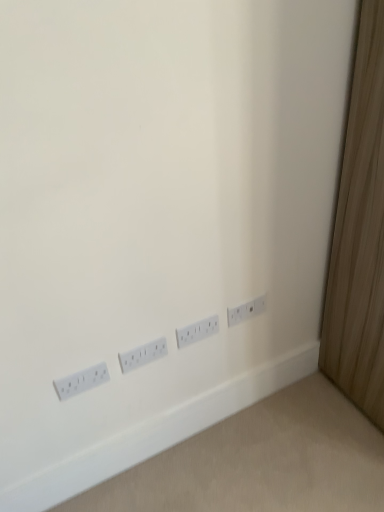
What do you see at coordinates (246, 310) in the screenshot? The width and height of the screenshot is (384, 512). I see `white plastic power plugs and sockets at lower right, the fourth power plugs and sockets viewed from the left` at bounding box center [246, 310].

In order to face white plastic power plugs and sockets at lower left, the fourth power plugs and sockets viewed from the right, should I rotate leftwards or rightwards?

A 14.332 degree turn to the left will do.

The width and height of the screenshot is (384, 512). Identify the location of white plastic power plugs and sockets at lower right, the 3th power plugs and sockets from the left. (197, 331).

You are a GUI agent. You are given a task and a screenshot of the screen. Output one action in this format:
    pyautogui.click(x=<x>, y=<y>)
    Task: Click on the white plastic power plugs and sockets at lower right, the first power plugs and sockets when ordered from right to left
    This screenshot has height=512, width=384.
    Given the screenshot: What is the action you would take?
    pyautogui.click(x=246, y=310)

From a real-world perspective, which is physically below, white plastic power plugs and sockets at center, marked as the third power plugs and sockets in a right-to-left arrangement, or white plastic power plugs and sockets at lower right, the 3th power plugs and sockets from the left?

From a 3D spatial view, white plastic power plugs and sockets at center, marked as the third power plugs and sockets in a right-to-left arrangement, is below.

Would you say white plastic power plugs and sockets at lower right, which is counted as the 2th power plugs and sockets, starting from the right, is part of white plastic power plugs and sockets at center, marked as the third power plugs and sockets in a right-to-left arrangement,'s contents?

Actually, white plastic power plugs and sockets at lower right, which is counted as the 2th power plugs and sockets, starting from the right, is outside white plastic power plugs and sockets at center, marked as the third power plugs and sockets in a right-to-left arrangement.

From the image's perspective, does white plastic power plugs and sockets at center, marked as the third power plugs and sockets in a right-to-left arrangement, appear lower than white plastic power plugs and sockets at lower right, the 3th power plugs and sockets from the left?

Result: Yes, from the image's perspective, white plastic power plugs and sockets at center, marked as the third power plugs and sockets in a right-to-left arrangement, is beneath white plastic power plugs and sockets at lower right, the 3th power plugs and sockets from the left.

Considering the sizes of white plastic power plugs and sockets at center, positioned as the second power plugs and sockets in left-to-right order, and white plastic power plugs and sockets at lower right, the 3th power plugs and sockets from the left, in the image, is white plastic power plugs and sockets at center, positioned as the second power plugs and sockets in left-to-right order, wider or thinner than white plastic power plugs and sockets at lower right, the 3th power plugs and sockets from the left,?

In the image, white plastic power plugs and sockets at center, positioned as the second power plugs and sockets in left-to-right order, appears to be more narrow than white plastic power plugs and sockets at lower right, the 3th power plugs and sockets from the left.

From a real-world perspective, which object rests below the other?

white plastic power plugs and sockets at lower left, the fourth power plugs and sockets viewed from the right, is physically lower.

Is white plastic power plugs and sockets at lower right, the first power plugs and sockets when ordered from right to left, closer to the viewer compared to white plastic power plugs and sockets at lower left, the 1th power plugs and sockets in the left-to-right sequence?

That is False.

Is white plastic power plugs and sockets at lower right, the first power plugs and sockets when ordered from right to left, to the right of white plastic power plugs and sockets at lower left, the 1th power plugs and sockets in the left-to-right sequence, from the viewer's perspective?

Indeed, white plastic power plugs and sockets at lower right, the first power plugs and sockets when ordered from right to left, is positioned on the right side of white plastic power plugs and sockets at lower left, the 1th power plugs and sockets in the left-to-right sequence.

Find the location of a particular element. the 3rd power plugs and sockets to the left of the white plastic power plugs and sockets at lower right, the fourth power plugs and sockets viewed from the left, starting your count from the anchor is located at coordinates (81, 381).

In the scene shown: Who is shorter, white plastic power plugs and sockets at lower left, the 1th power plugs and sockets in the left-to-right sequence, or white plastic power plugs and sockets at lower right, the first power plugs and sockets when ordered from right to left?

Standing shorter between the two is white plastic power plugs and sockets at lower right, the first power plugs and sockets when ordered from right to left.

Is white plastic power plugs and sockets at lower left, the fourth power plugs and sockets viewed from the right, inside or outside of white plastic power plugs and sockets at lower right, the first power plugs and sockets when ordered from right to left?

white plastic power plugs and sockets at lower left, the fourth power plugs and sockets viewed from the right, is not inside white plastic power plugs and sockets at lower right, the first power plugs and sockets when ordered from right to left, it's outside.

Is white plastic power plugs and sockets at lower left, the 1th power plugs and sockets in the left-to-right sequence, far from white plastic power plugs and sockets at lower right, the fourth power plugs and sockets viewed from the left?

Actually, white plastic power plugs and sockets at lower left, the 1th power plugs and sockets in the left-to-right sequence, and white plastic power plugs and sockets at lower right, the fourth power plugs and sockets viewed from the left, are a little close together.

From the image's perspective, is white plastic power plugs and sockets at lower left, the 1th power plugs and sockets in the left-to-right sequence, beneath white plastic power plugs and sockets at center, marked as the third power plugs and sockets in a right-to-left arrangement?

Yes, from the image's perspective, white plastic power plugs and sockets at lower left, the 1th power plugs and sockets in the left-to-right sequence, is below white plastic power plugs and sockets at center, marked as the third power plugs and sockets in a right-to-left arrangement.

Based on their positions, is white plastic power plugs and sockets at lower left, the fourth power plugs and sockets viewed from the right, located to the left or right of white plastic power plugs and sockets at center, positioned as the second power plugs and sockets in left-to-right order?

white plastic power plugs and sockets at lower left, the fourth power plugs and sockets viewed from the right, is positioned on white plastic power plugs and sockets at center, positioned as the second power plugs and sockets in left-to-right order,'s left side.

Which is behind, white plastic power plugs and sockets at lower left, the fourth power plugs and sockets viewed from the right, or white plastic power plugs and sockets at center, positioned as the second power plugs and sockets in left-to-right order?

white plastic power plugs and sockets at center, positioned as the second power plugs and sockets in left-to-right order, is behind.

Considering the sizes of objects white plastic power plugs and sockets at lower left, the fourth power plugs and sockets viewed from the right, and white plastic power plugs and sockets at center, positioned as the second power plugs and sockets in left-to-right order, in the image provided, who is bigger, white plastic power plugs and sockets at lower left, the fourth power plugs and sockets viewed from the right, or white plastic power plugs and sockets at center, positioned as the second power plugs and sockets in left-to-right order,?

With larger size is white plastic power plugs and sockets at center, positioned as the second power plugs and sockets in left-to-right order.

How different are the orientations of white plastic power plugs and sockets at lower right, which is counted as the 2th power plugs and sockets, starting from the right, and white plastic power plugs and sockets at lower left, the fourth power plugs and sockets viewed from the right, in degrees?

The angular difference between white plastic power plugs and sockets at lower right, which is counted as the 2th power plugs and sockets, starting from the right, and white plastic power plugs and sockets at lower left, the fourth power plugs and sockets viewed from the right, is 0.0184 degrees.

Which of these two, white plastic power plugs and sockets at lower right, the 3th power plugs and sockets from the left, or white plastic power plugs and sockets at lower left, the 1th power plugs and sockets in the left-to-right sequence, stands shorter?

white plastic power plugs and sockets at lower left, the 1th power plugs and sockets in the left-to-right sequence, is shorter.

From a real-world perspective, which object stands above the other?

From a 3D spatial view, white plastic power plugs and sockets at lower left, the 1th power plugs and sockets in the left-to-right sequence, is above.

This screenshot has height=512, width=384. I want to click on power plugs and sockets that is the 2nd one when counting forward from the white plastic power plugs and sockets at lower right, the 3th power plugs and sockets from the left, so click(x=81, y=381).

Which is behind, point (251, 315) or point (185, 331)?

Positioned behind is point (251, 315).

In the image, is white plastic power plugs and sockets at lower right, the fourth power plugs and sockets viewed from the left, positioned in front of or behind white plastic power plugs and sockets at lower right, which is counted as the 2th power plugs and sockets, starting from the right?

Clearly, white plastic power plugs and sockets at lower right, the fourth power plugs and sockets viewed from the left, is behind white plastic power plugs and sockets at lower right, which is counted as the 2th power plugs and sockets, starting from the right.

Is white plastic power plugs and sockets at lower right, the first power plugs and sockets when ordered from right to left, aimed at white plastic power plugs and sockets at lower right, the 3th power plugs and sockets from the left?

No, white plastic power plugs and sockets at lower right, the first power plugs and sockets when ordered from right to left, is not oriented towards white plastic power plugs and sockets at lower right, the 3th power plugs and sockets from the left.

From a real-world perspective, which object rests below the other?

white plastic power plugs and sockets at lower right, which is counted as the 2th power plugs and sockets, starting from the right, from a real-world perspective.

Which of these two, white plastic power plugs and sockets at lower right, which is counted as the 2th power plugs and sockets, starting from the right, or white plastic power plugs and sockets at center, positioned as the second power plugs and sockets in left-to-right order, is wider?

white plastic power plugs and sockets at lower right, which is counted as the 2th power plugs and sockets, starting from the right.

Could you tell me if white plastic power plugs and sockets at lower right, the 3th power plugs and sockets from the left, is facing white plastic power plugs and sockets at center, positioned as the second power plugs and sockets in left-to-right order?

A: No, white plastic power plugs and sockets at lower right, the 3th power plugs and sockets from the left, is not turned towards white plastic power plugs and sockets at center, positioned as the second power plugs and sockets in left-to-right order.

How many degrees apart are the facing directions of white plastic power plugs and sockets at lower right, the 3th power plugs and sockets from the left, and white plastic power plugs and sockets at center, positioned as the second power plugs and sockets in left-to-right order?

The angular difference between white plastic power plugs and sockets at lower right, the 3th power plugs and sockets from the left, and white plastic power plugs and sockets at center, positioned as the second power plugs and sockets in left-to-right order, is 0.00606 degrees.

From a real-world perspective, which power plugs and sockets is the 1st one above the white plastic power plugs and sockets at center, positioned as the second power plugs and sockets in left-to-right order? Please provide its 2D coordinates.

[(197, 331)]

Which power plugs and sockets is the 3rd one when counting from the back of the white plastic power plugs and sockets at lower left, the 1th power plugs and sockets in the left-to-right sequence? Please provide its 2D coordinates.

[(246, 310)]

Based on their spatial positions, is white plastic power plugs and sockets at lower right, the fourth power plugs and sockets viewed from the left, or white plastic power plugs and sockets at center, positioned as the second power plugs and sockets in left-to-right order, closer to white plastic power plugs and sockets at lower left, the 1th power plugs and sockets in the left-to-right sequence?

white plastic power plugs and sockets at center, positioned as the second power plugs and sockets in left-to-right order, is positioned closer to the anchor white plastic power plugs and sockets at lower left, the 1th power plugs and sockets in the left-to-right sequence.

Based on their spatial positions, is white plastic power plugs and sockets at lower right, the 3th power plugs and sockets from the left, or white plastic power plugs and sockets at center, marked as the third power plugs and sockets in a right-to-left arrangement, closer to white plastic power plugs and sockets at lower left, the 1th power plugs and sockets in the left-to-right sequence?

Among the two, white plastic power plugs and sockets at center, marked as the third power plugs and sockets in a right-to-left arrangement, is located nearer to white plastic power plugs and sockets at lower left, the 1th power plugs and sockets in the left-to-right sequence.

Considering their positions, is white plastic power plugs and sockets at lower right, which is counted as the 2th power plugs and sockets, starting from the right, positioned further to white plastic power plugs and sockets at center, positioned as the second power plugs and sockets in left-to-right order, than white plastic power plugs and sockets at lower right, the first power plugs and sockets when ordered from right to left?

white plastic power plugs and sockets at lower right, the first power plugs and sockets when ordered from right to left, is further to white plastic power plugs and sockets at center, positioned as the second power plugs and sockets in left-to-right order.

When comparing their distances from white plastic power plugs and sockets at lower right, the fourth power plugs and sockets viewed from the left, does white plastic power plugs and sockets at lower left, the fourth power plugs and sockets viewed from the right, or white plastic power plugs and sockets at center, positioned as the second power plugs and sockets in left-to-right order, seem closer?

white plastic power plugs and sockets at center, positioned as the second power plugs and sockets in left-to-right order, lies closer to white plastic power plugs and sockets at lower right, the fourth power plugs and sockets viewed from the left, than the other object.

Based on their spatial positions, is white plastic power plugs and sockets at lower left, the 1th power plugs and sockets in the left-to-right sequence, or white plastic power plugs and sockets at lower right, the 3th power plugs and sockets from the left, closer to white plastic power plugs and sockets at lower right, the first power plugs and sockets when ordered from right to left?

The object closer to white plastic power plugs and sockets at lower right, the first power plugs and sockets when ordered from right to left, is white plastic power plugs and sockets at lower right, the 3th power plugs and sockets from the left.

Which object lies nearer to the anchor point white plastic power plugs and sockets at center, marked as the third power plugs and sockets in a right-to-left arrangement, white plastic power plugs and sockets at lower left, the 1th power plugs and sockets in the left-to-right sequence, or white plastic power plugs and sockets at lower right, which is counted as the 2th power plugs and sockets, starting from the right?

white plastic power plugs and sockets at lower right, which is counted as the 2th power plugs and sockets, starting from the right, is closer to white plastic power plugs and sockets at center, marked as the third power plugs and sockets in a right-to-left arrangement.

Considering their positions, is white plastic power plugs and sockets at lower right, the fourth power plugs and sockets viewed from the left, positioned further to white plastic power plugs and sockets at lower right, which is counted as the 2th power plugs and sockets, starting from the right, than white plastic power plugs and sockets at center, positioned as the second power plugs and sockets in left-to-right order?

The object further to white plastic power plugs and sockets at lower right, which is counted as the 2th power plugs and sockets, starting from the right, is white plastic power plugs and sockets at center, positioned as the second power plugs and sockets in left-to-right order.

When comparing their distances from white plastic power plugs and sockets at center, positioned as the second power plugs and sockets in left-to-right order, does white plastic power plugs and sockets at lower right, the first power plugs and sockets when ordered from right to left, or white plastic power plugs and sockets at lower left, the 1th power plugs and sockets in the left-to-right sequence, seem further?

white plastic power plugs and sockets at lower right, the first power plugs and sockets when ordered from right to left.

At what (x,y) coordinates should I click in order to perform the action: click on power plugs and sockets between white plastic power plugs and sockets at center, positioned as the second power plugs and sockets in left-to-right order, and white plastic power plugs and sockets at lower right, the fourth power plugs and sockets viewed from the left, from left to right. Please return your answer as a coordinate pair (x, y). This screenshot has width=384, height=512. Looking at the image, I should click on (197, 331).

The height and width of the screenshot is (512, 384). Identify the location of power plugs and sockets between white plastic power plugs and sockets at lower left, the 1th power plugs and sockets in the left-to-right sequence, and white plastic power plugs and sockets at lower right, which is counted as the 2th power plugs and sockets, starting from the right, from left to right. (143, 355).